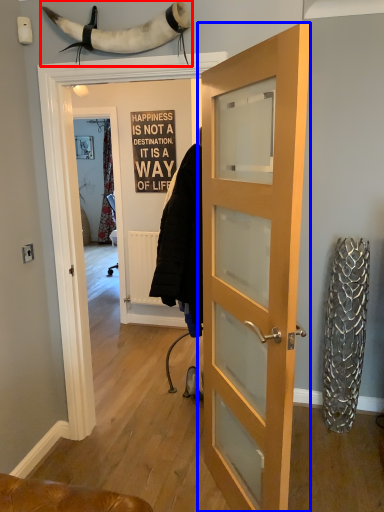
Question: Which object is closer to the camera taking this photo, animal (highlighted by a red box) or door (highlighted by a blue box)?

Choices:
 (A) animal
 (B) door

Answer: (B)